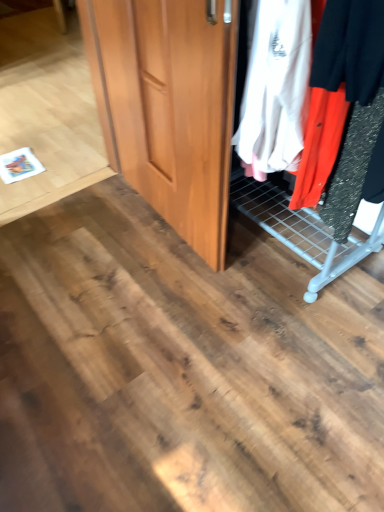
Locate an element on the screen. vacant space in front of wooden door at center is located at coordinates (154, 301).